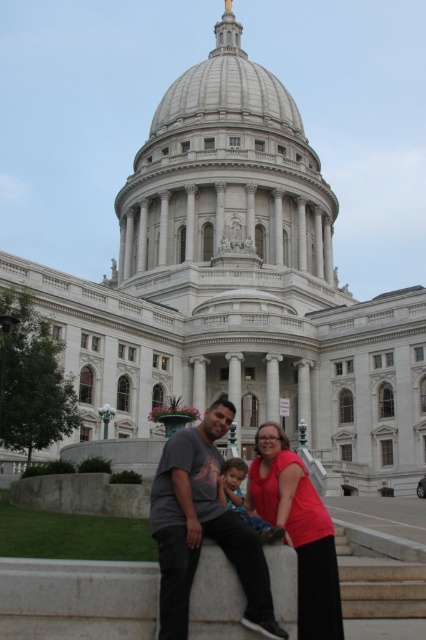
Question: Does matte gray t-shirt at center appear under matte gray shirt at center?

Choices:
 (A) no
 (B) yes

Answer: (B)

Question: Which point is closer to the camera?

Choices:
 (A) (267, 524)
 (B) (189, 596)

Answer: (B)

Question: Does matte gray t-shirt at center have a larger size compared to matte gray shirt at center?

Choices:
 (A) no
 (B) yes

Answer: (B)

Question: Which object is farther from the camera taking this photo?

Choices:
 (A) matte gray shirt at center
 (B) matte gray t-shirt at center

Answer: (A)

Question: Is matte gray t-shirt at center above matte gray shirt at center?

Choices:
 (A) no
 (B) yes

Answer: (A)